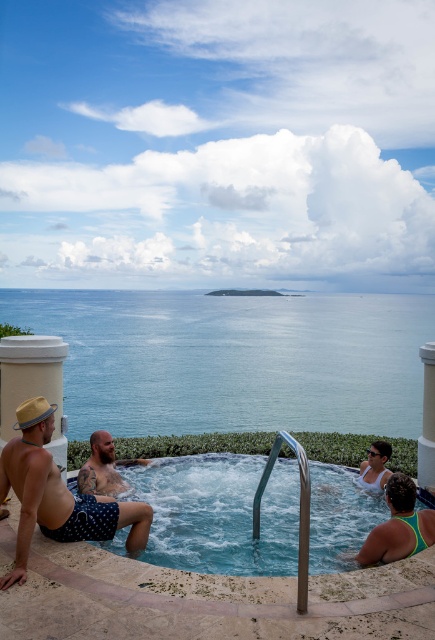
You are standing at the camera position and want to toss a beach ball into the clear plastic hot tub at center. Considering the distance, can you throw the ball from where you are to reach the hot tub?

The clear plastic hot tub at center is 13.91 feet away from the camera. Assuming an average throwing distance of about 15 feet for a beach ball, you should be able to reach it with a strong throw.

You are standing at the edge of the clear plastic hot tub at center. If you walk straight towards the distant landmass visible on the horizon, will you eventually reach the ocean?

Yes, walking straight towards the distant landmass from the clear plastic hot tub at center will lead you towards the ocean since the hot tub overlooks the vast ocean.